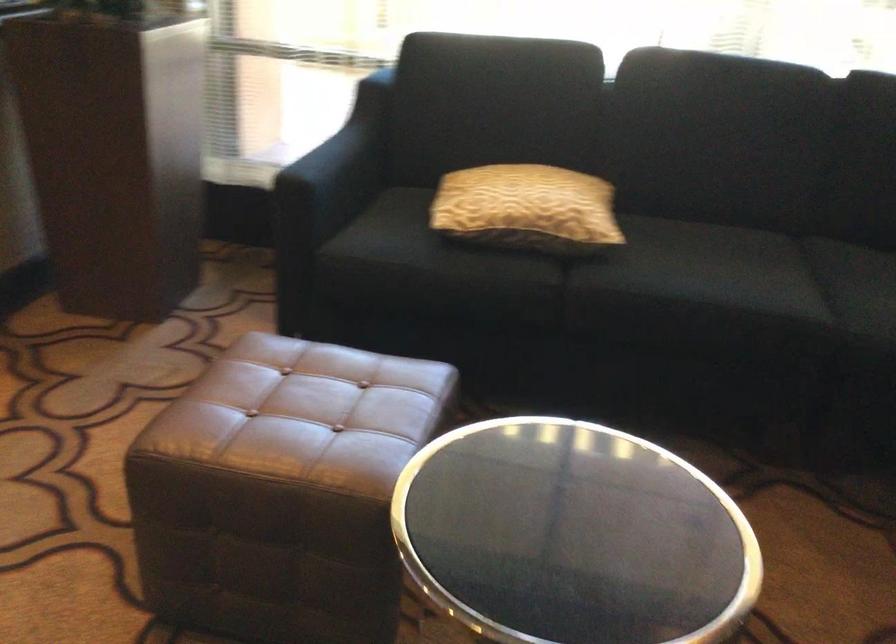
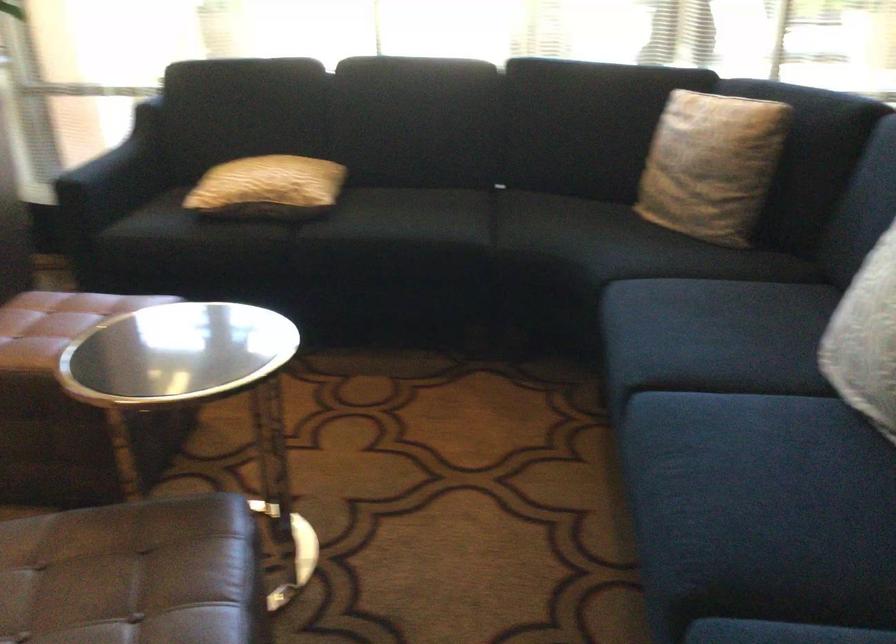
Question: The camera is either moving clockwise (left) or counter-clockwise (right) around the object. The first image is from the beginning of the video and the second image is from the end. Is the camera moving left or right when shooting the video?

Choices:
 (A) Left
 (B) Right

Answer: (A)